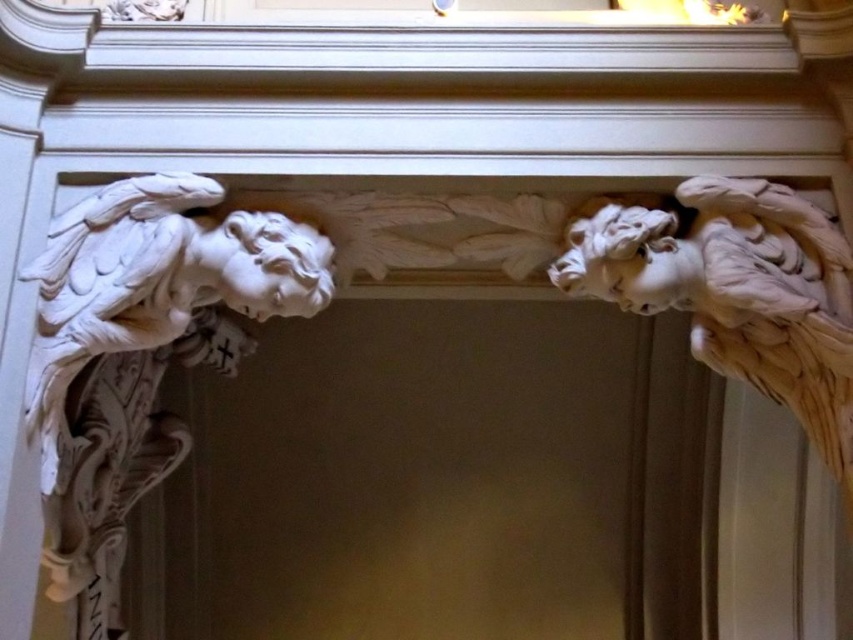
You are an art restorer examining the ornate stone relief. You need to clean both the white marble angel at left and the white marble angel at upper right. Which angel should you start with to avoid having to climb a ladder?

You should start with the white marble angel at left because it is closer to the viewer and can be reached without a ladder, whereas the white marble angel at upper right is further away and might require a ladder to access.